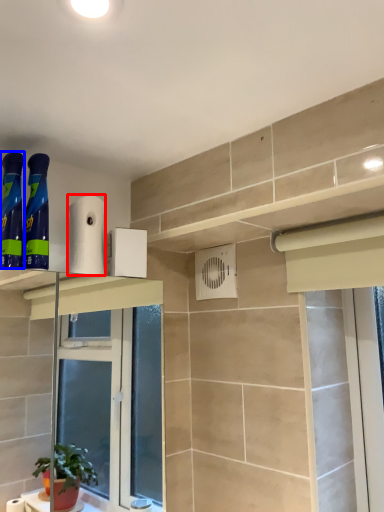
Question: Which object is further to the camera taking this photo, toilet paper (highlighted by a red box) or cleaning product (highlighted by a blue box)?

Choices:
 (A) toilet paper
 (B) cleaning product

Answer: (A)